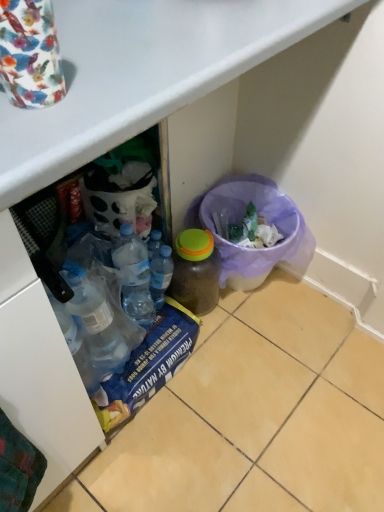
I want to click on purple mesh bin at lower right, so click(265, 222).

The image size is (384, 512). What do you see at coordinates (160, 275) in the screenshot?
I see `transparent plastic bottle at center, acting as the 1th bottle starting from the left` at bounding box center [160, 275].

The image size is (384, 512). Find the location of `translucent plastic bottle at center, placed as the 2th bottle when sorted from left to right`. translucent plastic bottle at center, placed as the 2th bottle when sorted from left to right is located at coordinates (196, 271).

Is purple mesh bin at lower right with translucent plastic bottle at center, the 1th bottle from the right?

purple mesh bin at lower right and translucent plastic bottle at center, the 1th bottle from the right, are not in contact.

From the picture: From the image's perspective, which one is positioned higher, purple mesh bin at lower right or translucent plastic bottle at center, the 1th bottle from the right?

purple mesh bin at lower right.

Is purple mesh bin at lower right shorter than translucent plastic bottle at center, the 1th bottle from the right?

In fact, purple mesh bin at lower right may be taller than translucent plastic bottle at center, the 1th bottle from the right.

Is purple mesh bin at lower right located outside translucent plastic bottle at center, placed as the 2th bottle when sorted from left to right?

Yes, purple mesh bin at lower right is outside of translucent plastic bottle at center, placed as the 2th bottle when sorted from left to right.

Is purple mesh bin at lower right a part of translucent plastic bottle at center, placed as the 2th bottle when sorted from left to right?

No, purple mesh bin at lower right is not surrounded by translucent plastic bottle at center, placed as the 2th bottle when sorted from left to right.

Considering the relative sizes of translucent plastic bottle at center, placed as the 2th bottle when sorted from left to right, and purple mesh bin at lower right in the image provided, is translucent plastic bottle at center, placed as the 2th bottle when sorted from left to right, bigger than purple mesh bin at lower right?

No.

In the scene shown: Considering the relative positions of translucent plastic bottle at center, placed as the 2th bottle when sorted from left to right, and purple mesh bin at lower right in the image provided, is translucent plastic bottle at center, placed as the 2th bottle when sorted from left to right, to the left or to the right of purple mesh bin at lower right?

From the image, it's evident that translucent plastic bottle at center, placed as the 2th bottle when sorted from left to right, is to the left of purple mesh bin at lower right.

Which of these two, translucent plastic bottle at center, the 1th bottle from the right, or purple mesh bin at lower right, is thinner?

With smaller width is translucent plastic bottle at center, the 1th bottle from the right.

Considering the relative sizes of transparent plastic bottle at center, acting as the 1th bottle starting from the left, and purple mesh bin at lower right in the image provided, is transparent plastic bottle at center, acting as the 1th bottle starting from the left, thinner than purple mesh bin at lower right?

Indeed, transparent plastic bottle at center, acting as the 1th bottle starting from the left, has a lesser width compared to purple mesh bin at lower right.

Which is behind, point (170, 267) or point (222, 250)?

Point (222, 250)

Which of these two, transparent plastic bottle at center, which appears as the 2th bottle when viewed from the right, or purple mesh bin at lower right, is bigger?

purple mesh bin at lower right is bigger.

From the picture: Could you tell me if transparent plastic bottle at center, which appears as the 2th bottle when viewed from the right, is facing purple mesh bin at lower right?

No, transparent plastic bottle at center, which appears as the 2th bottle when viewed from the right, is not turned towards purple mesh bin at lower right.

Which is in front, point (207, 244) or point (156, 298)?

Positioned in front is point (207, 244).

Is transparent plastic bottle at center, acting as the 1th bottle starting from the left, surrounded by translucent plastic bottle at center, the 1th bottle from the right?

No, translucent plastic bottle at center, the 1th bottle from the right, does not contain transparent plastic bottle at center, acting as the 1th bottle starting from the left.

Relative to transparent plastic bottle at center, which appears as the 2th bottle when viewed from the right, is translucent plastic bottle at center, placed as the 2th bottle when sorted from left to right, in front or behind?

translucent plastic bottle at center, placed as the 2th bottle when sorted from left to right, is behind transparent plastic bottle at center, which appears as the 2th bottle when viewed from the right.

Consider the image. Is transparent plastic bottle at center, which appears as the 2th bottle when viewed from the right, at the back of translucent plastic bottle at center, placed as the 2th bottle when sorted from left to right?

No, transparent plastic bottle at center, which appears as the 2th bottle when viewed from the right, is not at the back of translucent plastic bottle at center, placed as the 2th bottle when sorted from left to right.

Is point (159, 269) closer or farther from the camera than point (179, 263)?

Point (159, 269) appears to be closer to the viewer than point (179, 263).

Looking at this image, can we say transparent plastic bottle at center, which appears as the 2th bottle when viewed from the right, lies outside translucent plastic bottle at center, placed as the 2th bottle when sorted from left to right?

Yes, transparent plastic bottle at center, which appears as the 2th bottle when viewed from the right, is outside of translucent plastic bottle at center, placed as the 2th bottle when sorted from left to right.

Based on their positions, is transparent plastic bottle at center, which appears as the 2th bottle when viewed from the right, located to the left or right of translucent plastic bottle at center, placed as the 2th bottle when sorted from left to right?

transparent plastic bottle at center, which appears as the 2th bottle when viewed from the right, is to the left of translucent plastic bottle at center, placed as the 2th bottle when sorted from left to right.

Can you confirm if purple mesh bin at lower right is smaller than transparent plastic bottle at center, acting as the 1th bottle starting from the left?

No, purple mesh bin at lower right is not smaller than transparent plastic bottle at center, acting as the 1th bottle starting from the left.

Is purple mesh bin at lower right far away from transparent plastic bottle at center, which appears as the 2th bottle when viewed from the right?

They are positioned close to each other.

Is purple mesh bin at lower right further to the viewer compared to transparent plastic bottle at center, which appears as the 2th bottle when viewed from the right?

Yes, purple mesh bin at lower right is further from the viewer.

Can you confirm if purple mesh bin at lower right is thinner than transparent plastic bottle at center, acting as the 1th bottle starting from the left?

No.

The height and width of the screenshot is (512, 384). In order to click on bottle that is the 1st one above the purple mesh bin at lower right (from a real-world perspective) in this screenshot , I will do `click(196, 271)`.

At what (x,y) coordinates should I click in order to perform the action: click on recycling bin below the translucent plastic bottle at center, the 1th bottle from the right (from a real-world perspective). Please return your answer as a coordinate pair (x, y). The image size is (384, 512). Looking at the image, I should click on (265, 222).

Estimate the real-world distances between objects in this image. Which object is closer to purple mesh bin at lower right, transparent plastic bottle at center, acting as the 1th bottle starting from the left, or translucent plastic bottle at center, the 1th bottle from the right?

translucent plastic bottle at center, the 1th bottle from the right, is positioned closer to the anchor purple mesh bin at lower right.

Looking at this image, considering their positions, is transparent plastic bottle at center, which appears as the 2th bottle when viewed from the right, positioned closer to translucent plastic bottle at center, the 1th bottle from the right, than purple mesh bin at lower right?

The object closer to translucent plastic bottle at center, the 1th bottle from the right, is transparent plastic bottle at center, which appears as the 2th bottle when viewed from the right.

Considering their positions, is translucent plastic bottle at center, the 1th bottle from the right, positioned closer to purple mesh bin at lower right than transparent plastic bottle at center, acting as the 1th bottle starting from the left?

Based on the image, translucent plastic bottle at center, the 1th bottle from the right, appears to be nearer to purple mesh bin at lower right.

When comparing their distances from translucent plastic bottle at center, the 1th bottle from the right, does purple mesh bin at lower right or transparent plastic bottle at center, acting as the 1th bottle starting from the left, seem further?

purple mesh bin at lower right.

Based on their spatial positions, is translucent plastic bottle at center, the 1th bottle from the right, or purple mesh bin at lower right further from transparent plastic bottle at center, which appears as the 2th bottle when viewed from the right?

purple mesh bin at lower right is positioned further to the anchor transparent plastic bottle at center, which appears as the 2th bottle when viewed from the right.

Estimate the real-world distances between objects in this image. Which object is further from transparent plastic bottle at center, which appears as the 2th bottle when viewed from the right, purple mesh bin at lower right or translucent plastic bottle at center, the 1th bottle from the right?

Among the two, purple mesh bin at lower right is located further to transparent plastic bottle at center, which appears as the 2th bottle when viewed from the right.

Where is `bottle situated between transparent plastic bottle at center, acting as the 1th bottle starting from the left, and purple mesh bin at lower right from left to right`? bottle situated between transparent plastic bottle at center, acting as the 1th bottle starting from the left, and purple mesh bin at lower right from left to right is located at coordinates (196, 271).